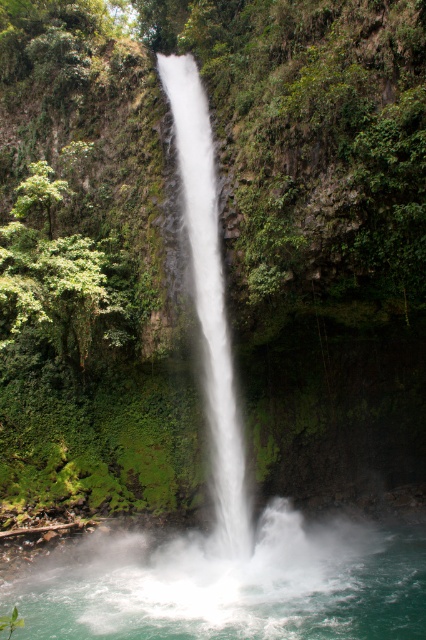
Question: Is clear water at center above white frothy water at center?

Choices:
 (A) no
 (B) yes

Answer: (A)

Question: Considering the relative positions of clear water at center and white frothy water at center in the image provided, where is clear water at center located with respect to white frothy water at center?

Choices:
 (A) right
 (B) left

Answer: (A)

Question: Is clear water at center positioned at the back of white frothy water at center?

Choices:
 (A) yes
 (B) no

Answer: (B)